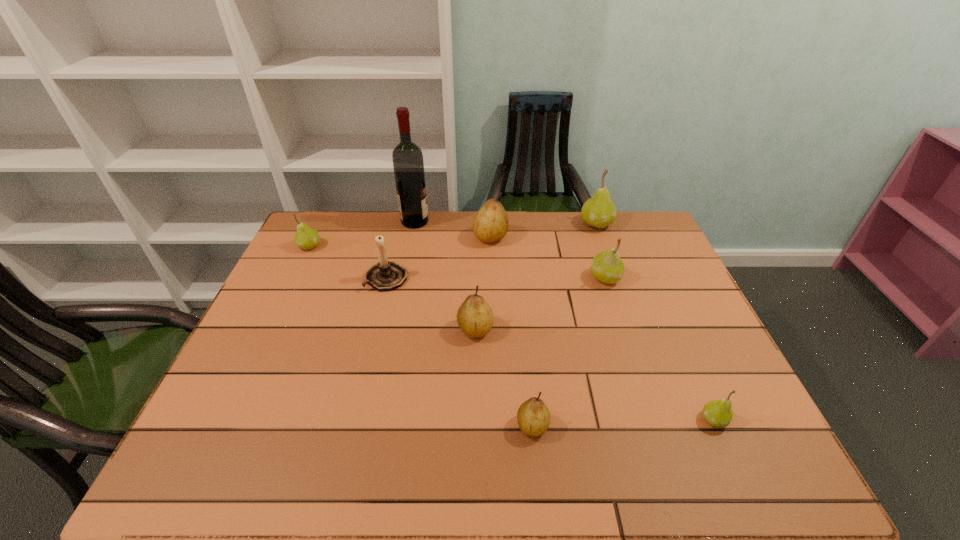
Where is `green pear identified as the second closest to the nearest brown pear`? green pear identified as the second closest to the nearest brown pear is located at coordinates (607, 267).

Identify which brown pear is the nearest to the nearest brown pear. Please provide its 2D coordinates. Your answer should be formatted as a tuple, i.e. [(x, y)], where the tuple contains the x and y coordinates of a point satisfying the conditions above.

[(475, 317)]

The image size is (960, 540). Find the location of `the third closest brown pear to the tallest object`. the third closest brown pear to the tallest object is located at coordinates (533, 416).

Where is `vacant space that satisfies the following two spatial constraints: 1. on the front side of the nearest brown pear; 2. on the right side of the farthest brown pear`? vacant space that satisfies the following two spatial constraints: 1. on the front side of the nearest brown pear; 2. on the right side of the farthest brown pear is located at coordinates (496, 426).

You are a GUI agent. You are given a task and a screenshot of the screen. Output one action in this format:
    pyautogui.click(x=<x>, y=<y>)
    Task: Click on the free space that satisfies the following two spatial constraints: 1. on the front and back of the alcohol; 2. on the back side of the second biggest green pear
    Image resolution: width=960 pixels, height=540 pixels.
    Given the screenshot: What is the action you would take?
    pyautogui.click(x=403, y=278)

I want to click on blank space that satisfies the following two spatial constraints: 1. on the back side of the rightmost pear; 2. on the left side of the smallest brown pear, so click(532, 420).

The height and width of the screenshot is (540, 960). I want to click on free spot that satisfies the following two spatial constraints: 1. on the front and back of the tallest pear; 2. on the left side of the tallest object, so click(x=415, y=224).

Locate an element on the screen. This screenshot has height=540, width=960. free space that satisfies the following two spatial constraints: 1. on the front and back of the tallest object; 2. on the back side of the fourth nearest pear is located at coordinates pyautogui.click(x=403, y=278).

Locate an element on the screen. This screenshot has height=540, width=960. free space that satisfies the following two spatial constraints: 1. on the front and back of the biggest brown pear; 2. on the left side of the tallest object is located at coordinates (412, 237).